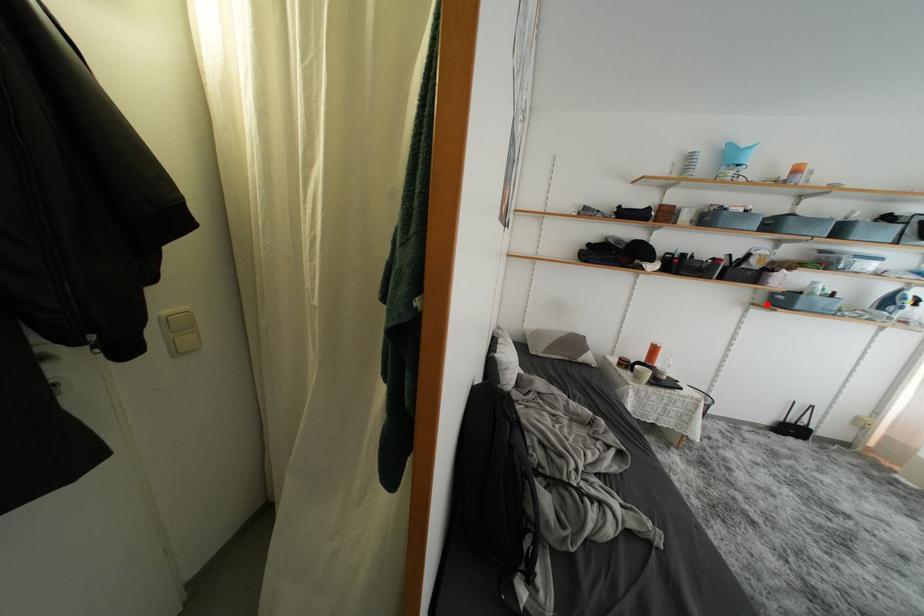
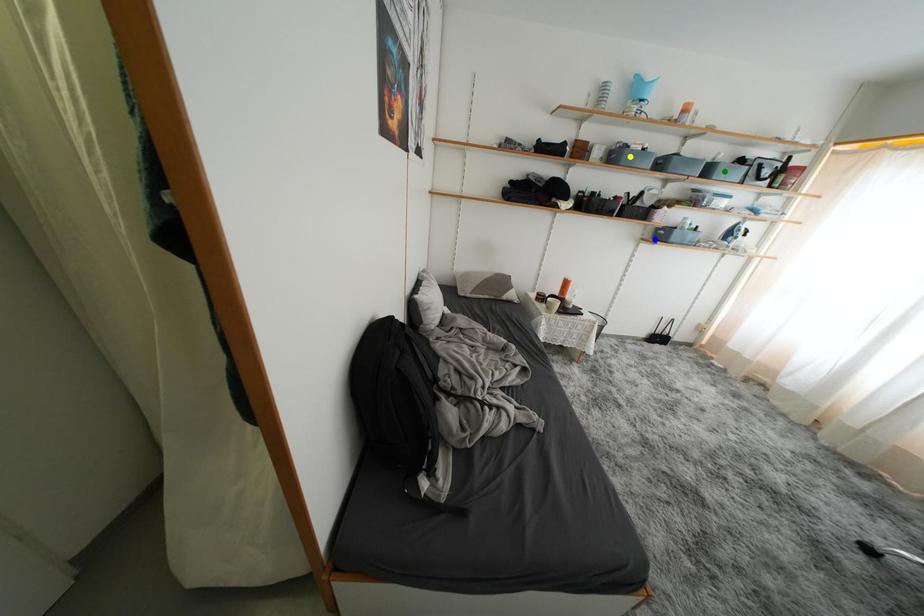
Question: I am providing you with two images of the same scene from different viewpoints. A red point is marked on the first image. You are given multiple points on the second image. Which point in image 2 is actually the same real-world point as the red point in image 1?

Choices:
 (A) blue point
 (B) yellow point
 (C) green point

Answer: (A)